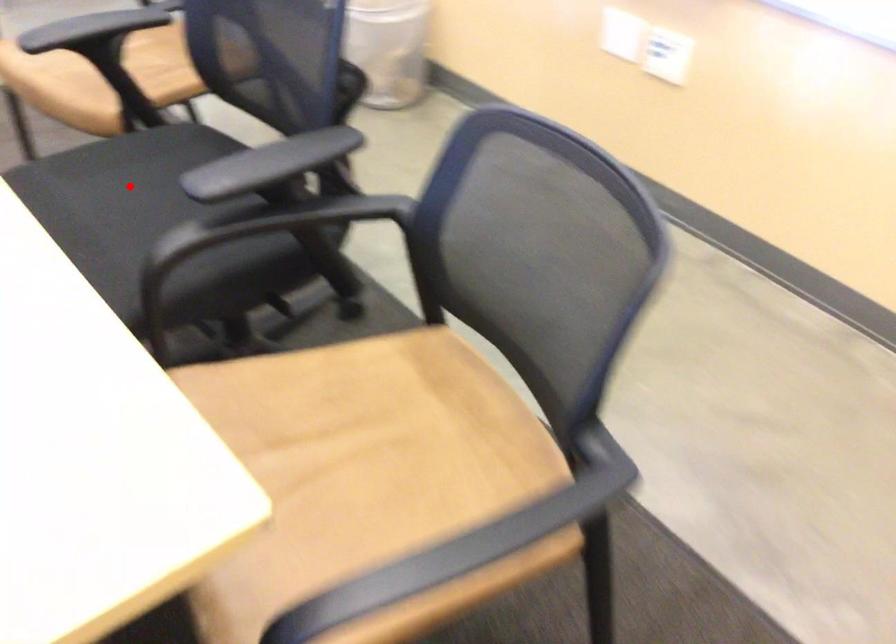
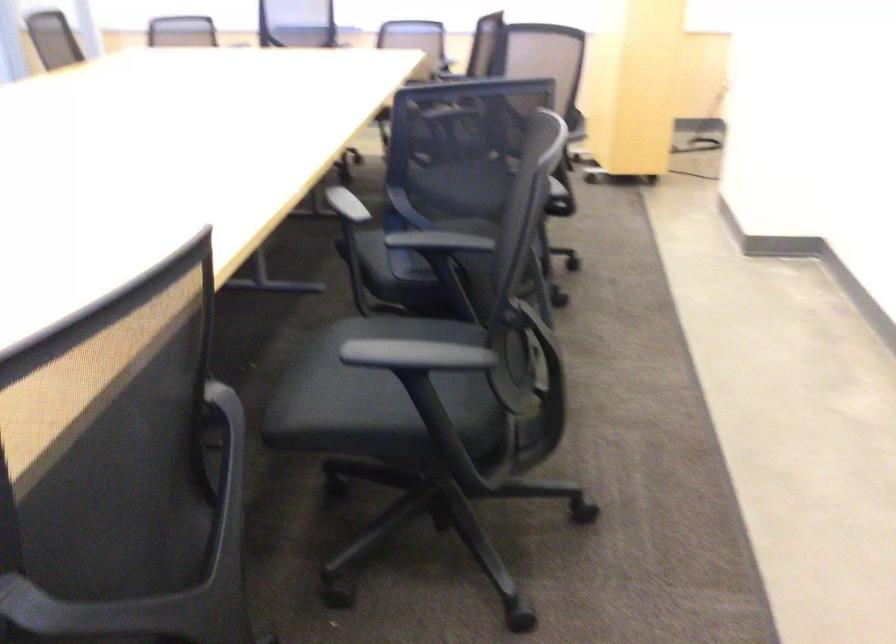
Question: I am providing you with two images of the same scene from different viewpoints. A red point is marked on the first image. Is the red point's position out of view in image 2?

Choices:
 (A) Yes
 (B) No

Answer: (A)